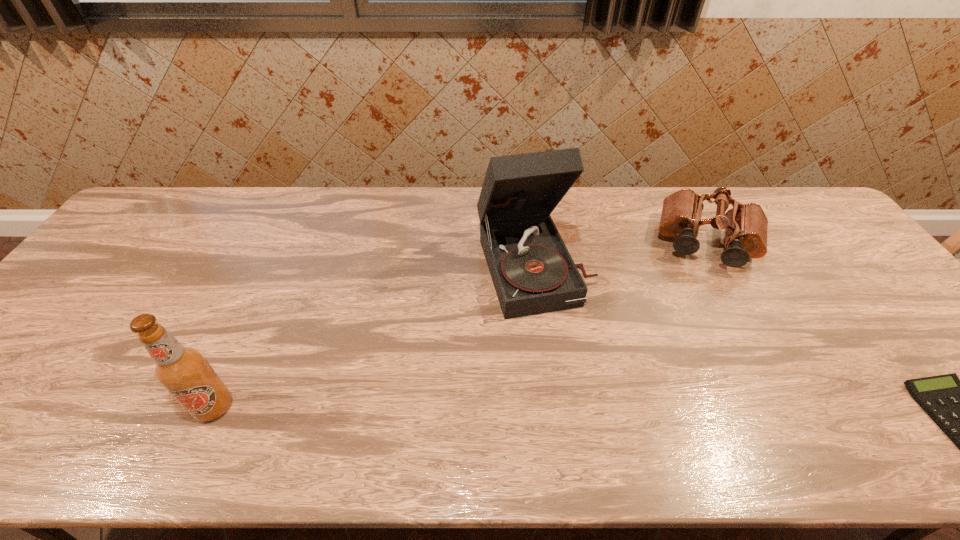
Find the location of a particular element. Image resolution: width=960 pixels, height=540 pixels. blank region between the beer bottle and the binoculars is located at coordinates (461, 325).

Identify which object is located as the second nearest to the rightmost object. Please provide its 2D coordinates. Your answer should be formatted as a tuple, i.e. [(x, y)], where the tuple contains the x and y coordinates of a point satisfying the conditions above.

[(533, 273)]

Locate which object is the closest to the shortest object. Please provide its 2D coordinates. Your answer should be formatted as a tuple, i.e. [(x, y)], where the tuple contains the x and y coordinates of a point satisfying the conditions above.

[(745, 225)]